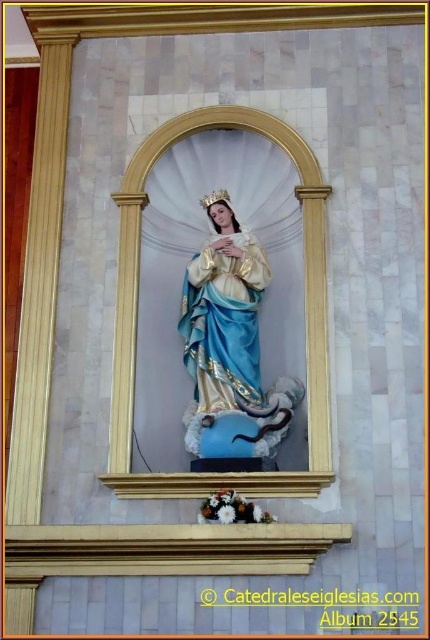
Can you confirm if matte gold statue at center is wider than blue satin dress at center?

Yes.

Is matte gold statue at center above blue satin dress at center?

Incorrect, matte gold statue at center is not positioned above blue satin dress at center.

Which is behind, point (227, 310) or point (227, 388)?

Point (227, 310)

Find the location of `matte gold statue at center`. matte gold statue at center is located at coordinates pyautogui.click(x=230, y=337).